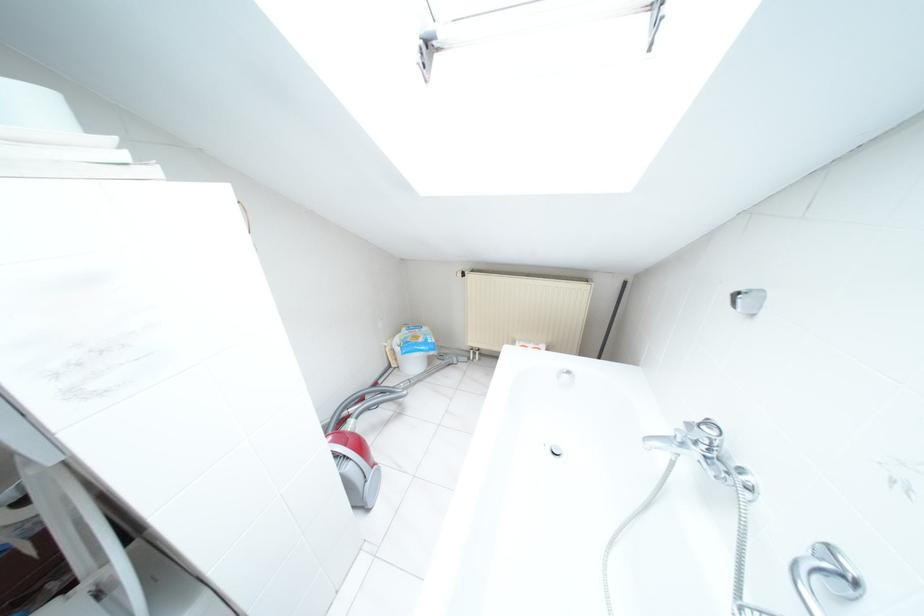
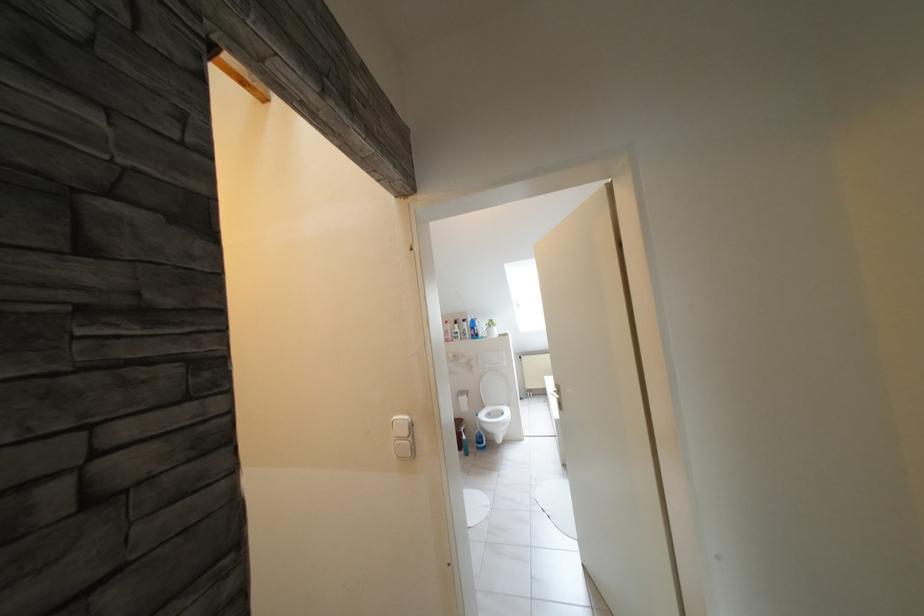
Which direction would the cameraman need to move to produce the second image?

The movement direction of the cameraman is left, backward.